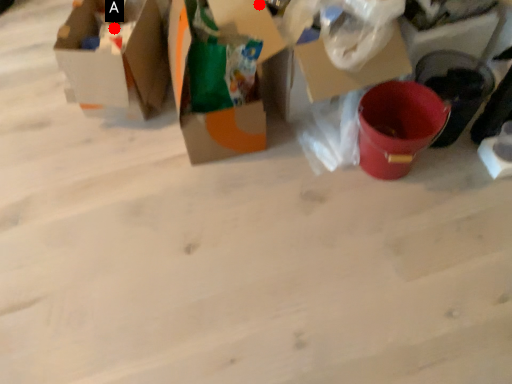
Question: Two points are circled on the image, labeled by A and B beside each circle. Which point is further to the camera?

Choices:
 (A) A is further
 (B) B is further

Answer: (A)